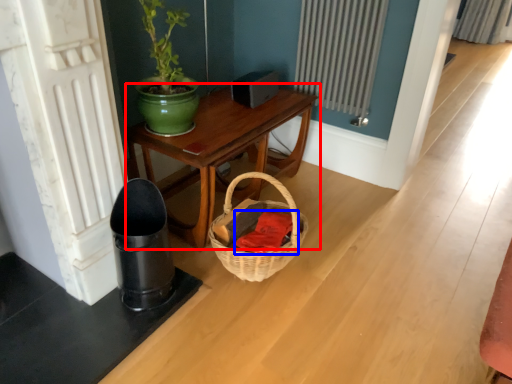
Question: Which object appears farthest to the camera in this image, table (highlighted by a red box) or clothing (highlighted by a blue box)?

Choices:
 (A) table
 (B) clothing

Answer: (A)